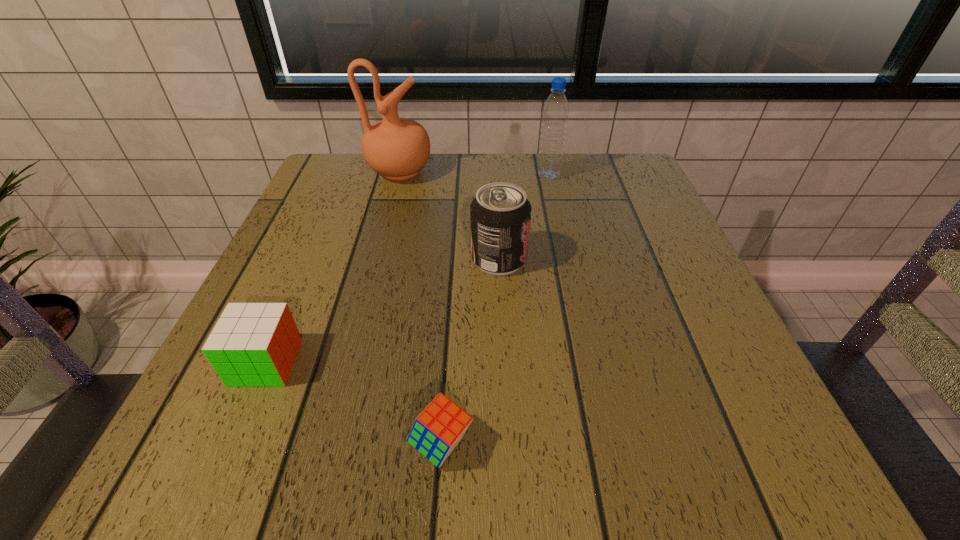
Find the location of a particular element. vacant area located on the left of the water bottle is located at coordinates (416, 175).

You are a GUI agent. You are given a task and a screenshot of the screen. Output one action in this format:
    pyautogui.click(x=<x>, y=<y>)
    Task: Click on the vacant space situated 0.310m on the left of the third farthest object
    The image size is (960, 540).
    Given the screenshot: What is the action you would take?
    pyautogui.click(x=308, y=259)

Identify the location of vacant space situated 0.160m on the right of the fourth farthest object. (400, 362).

At what (x,y) coordinates should I click in order to perform the action: click on vacant space located 0.310m on the right of the nearer cube. Please return your answer as a coordinate pair (x, y). Image resolution: width=960 pixels, height=540 pixels. Looking at the image, I should click on (713, 444).

Where is `pottery that is positioned at the far edge`? pottery that is positioned at the far edge is located at coordinates (397, 148).

Locate an element on the screen. This screenshot has width=960, height=540. water bottle present at the far edge is located at coordinates (555, 113).

Identify the location of object present at the near edge. The width and height of the screenshot is (960, 540). (437, 430).

The height and width of the screenshot is (540, 960). In order to click on pottery that is at the left edge in this screenshot , I will do `click(397, 148)`.

In order to click on cube at the left edge in this screenshot , I will do `click(253, 344)`.

The width and height of the screenshot is (960, 540). In order to click on object positioned at the far left corner in this screenshot , I will do `click(397, 148)`.